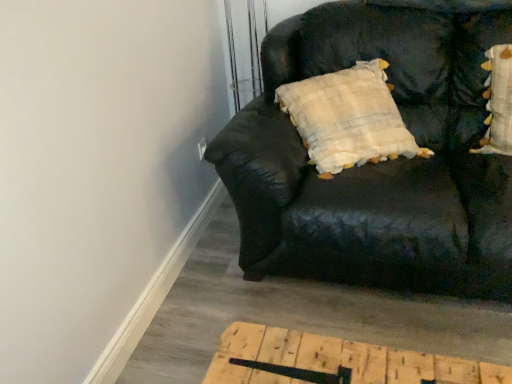
Question: Looking at their shapes, would you say black leather couch at upper right is wider or thinner than fluffy white pillow with yellow accents at upper right?

Choices:
 (A) thin
 (B) wide

Answer: (B)

Question: Is black leather couch at upper right to the left or to the right of fluffy white pillow with yellow accents at upper right in the image?

Choices:
 (A) right
 (B) left

Answer: (B)

Question: From a real-world perspective, is black leather couch at upper right positioned above or below fluffy white pillow with yellow accents at upper right?

Choices:
 (A) above
 (B) below

Answer: (B)

Question: From the image's perspective, is fluffy white pillow with yellow accents at upper right positioned above or below black leather couch at upper right?

Choices:
 (A) above
 (B) below

Answer: (A)

Question: Considering the relative positions of fluffy white pillow with yellow accents at upper right and black leather couch at upper right in the image provided, is fluffy white pillow with yellow accents at upper right to the left or to the right of black leather couch at upper right?

Choices:
 (A) right
 (B) left

Answer: (A)

Question: Does point (510, 82) appear closer or farther from the camera than point (328, 200)?

Choices:
 (A) closer
 (B) farther

Answer: (B)

Question: Considering the positions of fluffy white pillow with yellow accents at upper right and black leather couch at upper right in the image, is fluffy white pillow with yellow accents at upper right wider or thinner than black leather couch at upper right?

Choices:
 (A) thin
 (B) wide

Answer: (A)